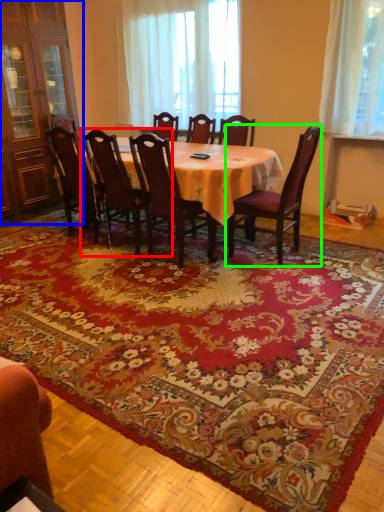
Question: Based on their relative distances, which object is nearer to chair (highlighted by a red box)? Choose from armoire (highlighted by a blue box) and chair (highlighted by a green box).

Choices:
 (A) armoire
 (B) chair

Answer: (B)